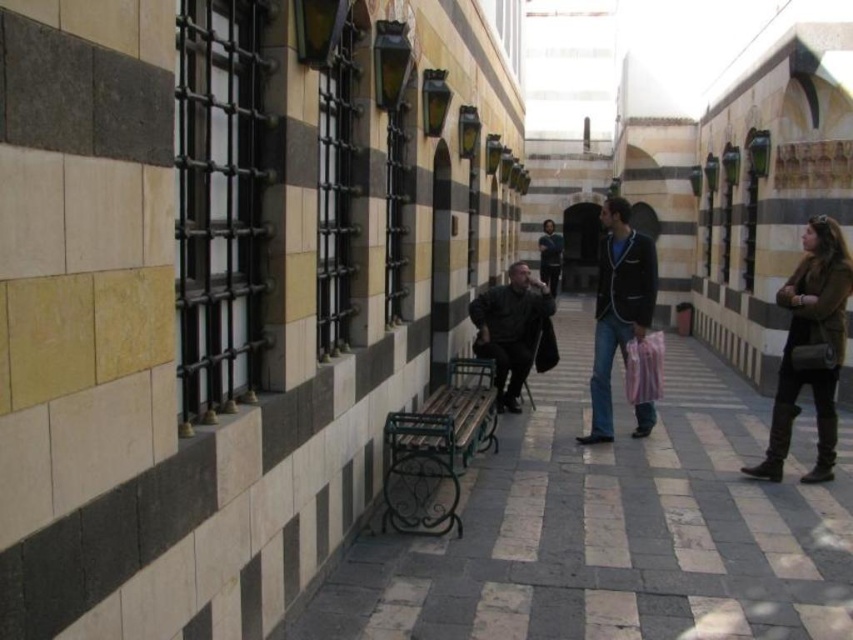
Question: Among these objects, which one is nearest to the camera?

Choices:
 (A) smooth stone pavement at center
 (B) blue denim jeans at center
 (C) dark blue jacket at center

Answer: (A)

Question: Can you confirm if blue denim jeans at center is smaller than dark blue jacket at center?

Choices:
 (A) no
 (B) yes

Answer: (A)

Question: Considering the relative positions of dark brown leather jacket at right and dark blue jacket at center in the image provided, where is dark brown leather jacket at right located with respect to dark blue jacket at center?

Choices:
 (A) left
 (B) right

Answer: (A)

Question: Estimate the real-world distances between objects in this image. Which object is farther from the dark brown leather jacket at right?

Choices:
 (A) blue denim jeans at center
 (B) dark blue jacket at center
 (C) smooth stone pavement at center
 (D) dark gray fabric jacket at center

Answer: (B)

Question: Is dark brown leather jacket at right positioned behind dark gray fabric jacket at center?

Choices:
 (A) yes
 (B) no

Answer: (B)

Question: Which point appears farthest from the camera in this image?

Choices:
 (A) (602, 436)
 (B) (828, 362)
 (C) (521, 291)

Answer: (C)